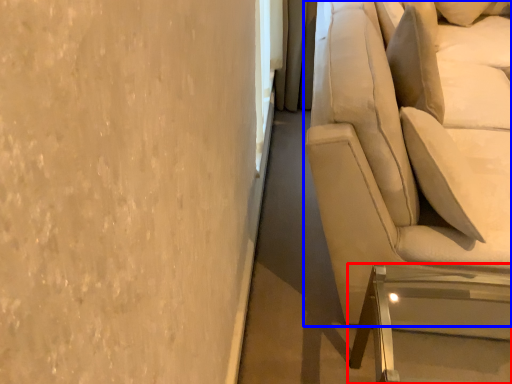
Question: Which of the following is the closest to the observer, furniture (highlighted by a red box) or studio couch (highlighted by a blue box)?

Choices:
 (A) furniture
 (B) studio couch

Answer: (B)